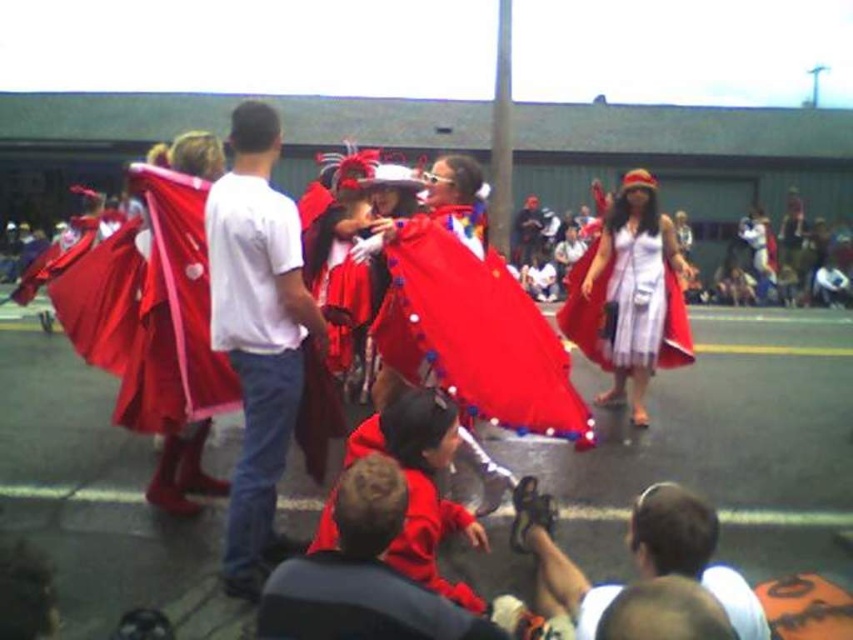
You are a photographer at the event and want to capture a photo of the red velvet cape at center and the matte black sandals at lower center. Based on their positions, which object should you focus on first to ensure both are in frame?

The red velvet cape at center is to the left of matte black sandals at lower center. To capture both in frame, focus on the red velvet cape at center first as it is positioned to the left, ensuring the matte black sandals at lower center remain within the shot.